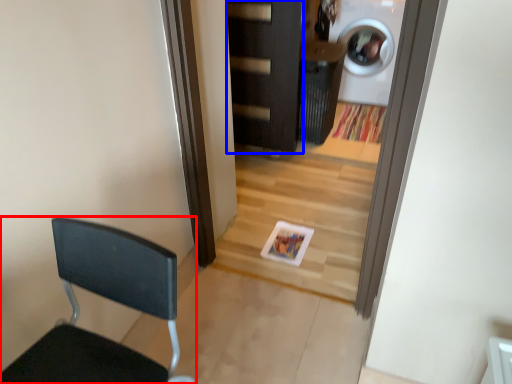
Question: Which of the following is the farthest to the observer, chair (highlighted by a red box) or door (highlighted by a blue box)?

Choices:
 (A) chair
 (B) door

Answer: (B)